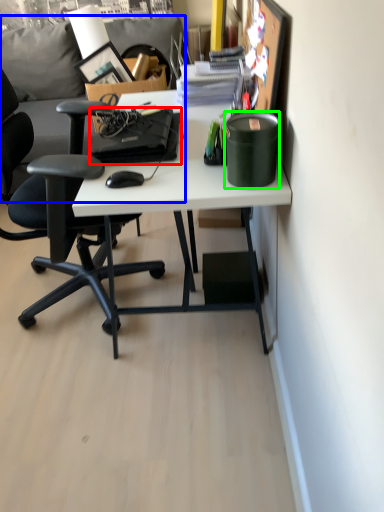
Question: Considering the real-world distances, which object is farthest from laptop (highlighted by a red box)? couch (highlighted by a blue box) or stationery (highlighted by a green box)?

Choices:
 (A) couch
 (B) stationery

Answer: (A)